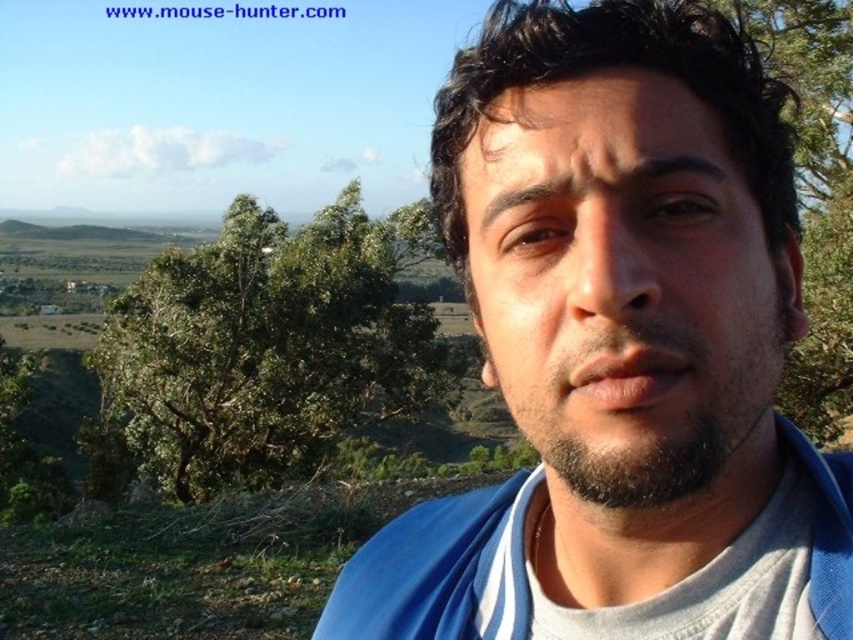
You are a photographer trying to capture the blue fabric shirt at center and the green leafy tree at upper left in the same frame. Which object is closer to the camera based on their positions?

The blue fabric shirt at center is closer to the camera because it is positioned over the green leafy tree at upper left, indicating it is in front of the tree.

You are taking a photo of the blue fabric shirt at center and the green leafy tree at upper left. Which object is positioned to the right side of the other?

The blue fabric shirt at center is to the right of the green leafy tree at upper left.